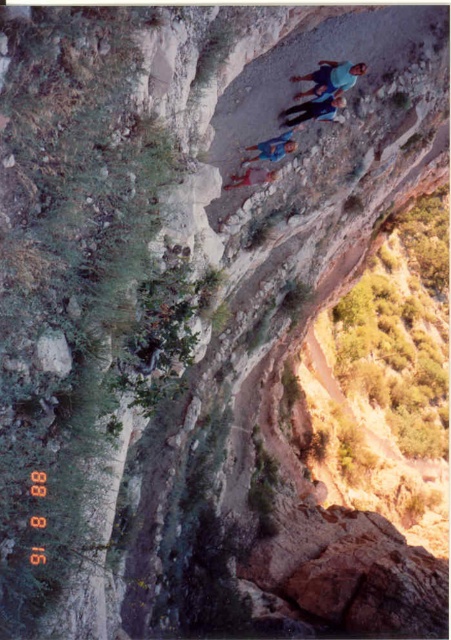
Question: Which object appears farthest from the camera in this image?

Choices:
 (A) blue fabric shirt at upper center
 (B) blue denim jeans at center

Answer: (B)

Question: Which point is closer to the camera?

Choices:
 (A) blue fabric shirt at upper center
 (B) blue denim jeans at center

Answer: (A)

Question: Can you confirm if blue fabric shirt at upper center is thinner than blue denim jeans at center?

Choices:
 (A) no
 (B) yes

Answer: (B)

Question: Can you confirm if blue fabric shirt at upper center is smaller than blue denim jeans at center?

Choices:
 (A) yes
 (B) no

Answer: (A)

Question: Can you confirm if blue fabric shirt at upper center is positioned below blue denim jeans at center?

Choices:
 (A) no
 (B) yes

Answer: (A)

Question: Among these objects, which one is farthest from the camera?

Choices:
 (A) blue fabric shirt at upper center
 (B) blue denim jeans at center

Answer: (B)